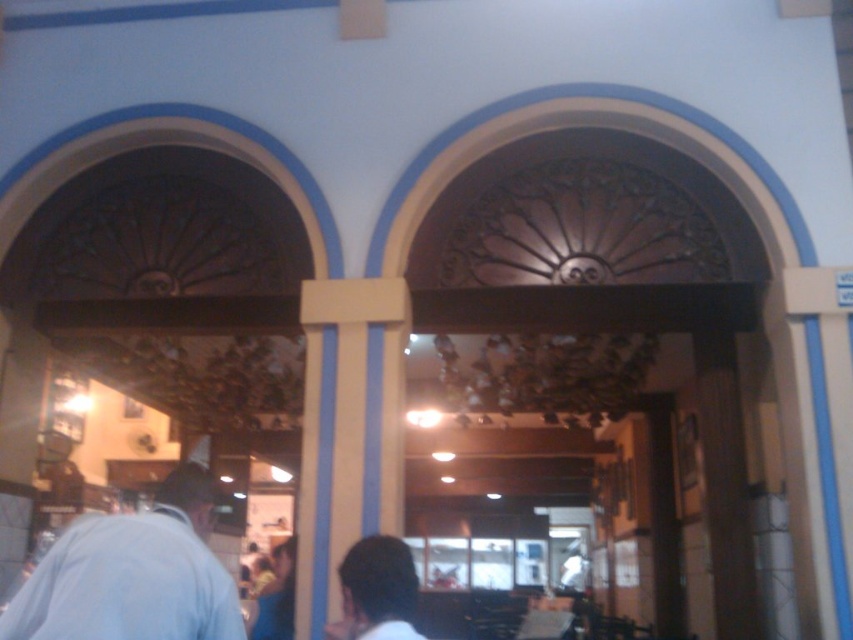
Consider the image. Does light blue shirt at lower left have a larger size compared to dark brown hair at lower center?

No, light blue shirt at lower left is not bigger than dark brown hair at lower center.

What do you see at coordinates (132, 573) in the screenshot? I see `light blue shirt at lower left` at bounding box center [132, 573].

This screenshot has width=853, height=640. Identify the location of light blue shirt at lower left. (132, 573).